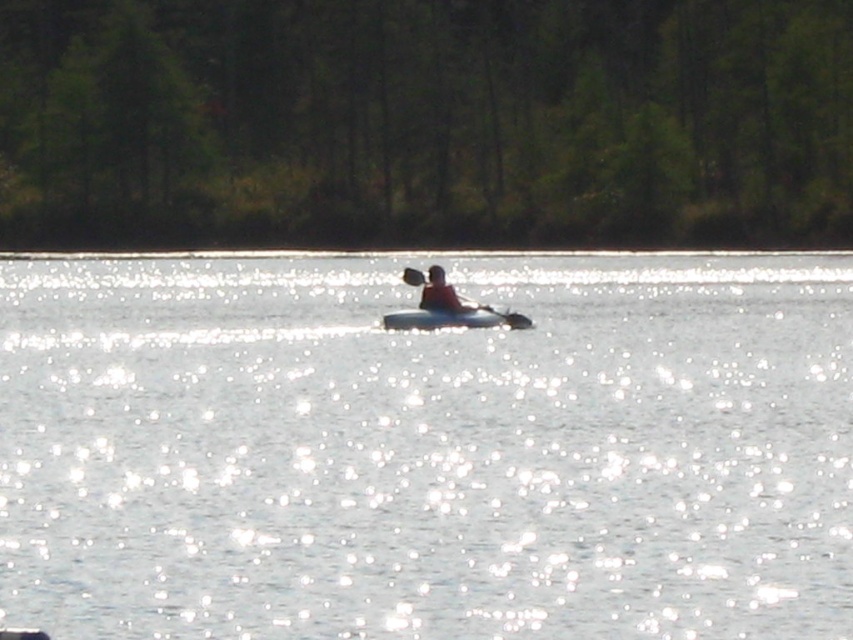
Question: From the image, what is the correct spatial relationship of glistening water at center in relation to matte red kayak at center?

Choices:
 (A) below
 (B) above

Answer: (A)

Question: Estimate the real-world distances between objects in this image. Which object is farther from the matte red kayak at center?

Choices:
 (A) glistening water at center
 (B) black rubber paddle at center

Answer: (A)

Question: Which of the following is the farthest from the observer?

Choices:
 (A) (440, 269)
 (B) (325, 595)

Answer: (A)

Question: Is glistening water at center to the right of black rubber paddle at center from the viewer's perspective?

Choices:
 (A) yes
 (B) no

Answer: (B)

Question: In this image, where is black rubber paddle at center located relative to matte red kayak at center?

Choices:
 (A) below
 (B) above

Answer: (A)

Question: Which of the following is the closest to the observer?

Choices:
 (A) (569, 548)
 (B) (433, 276)
 (C) (419, 317)

Answer: (A)